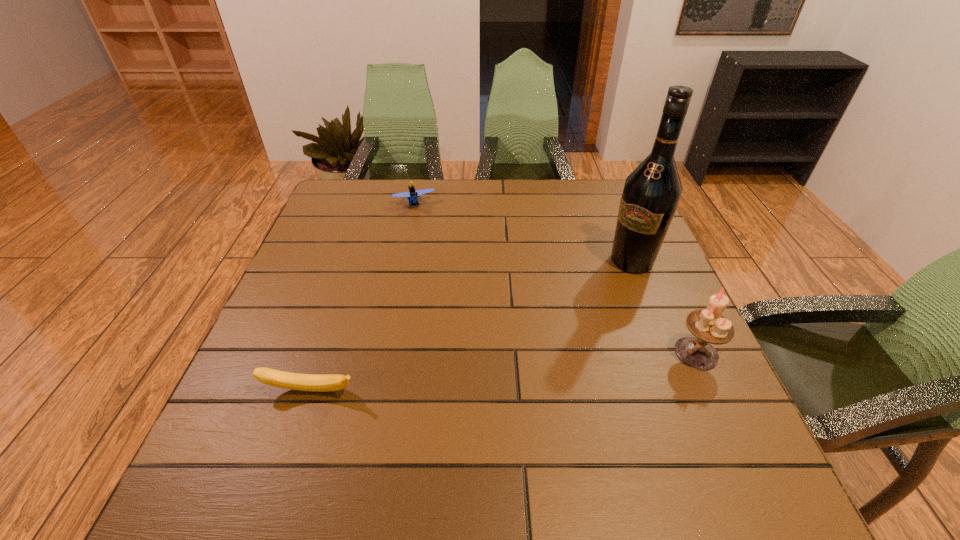
Image resolution: width=960 pixels, height=540 pixels. What are the coordinates of `vacant area situated on the label of the second farthest object` in the screenshot? It's located at (590, 313).

Find the location of `blank space located on the front-facing side of the Lego`. blank space located on the front-facing side of the Lego is located at coordinates (423, 227).

At what (x,y) coordinates should I click in order to perform the action: click on free location located 0.070m on the front-facing side of the Lego. Please return your answer as a coordinate pair (x, y). The image size is (960, 540). Looking at the image, I should click on (422, 225).

Locate an element on the screen. Image resolution: width=960 pixels, height=540 pixels. vacant space located 0.200m on the front-facing side of the Lego is located at coordinates (432, 253).

I want to click on object present at the far edge, so click(412, 196).

Identify the location of object that is at the near edge. (303, 382).

The width and height of the screenshot is (960, 540). What are the coordinates of `object located in the left edge section of the desktop` in the screenshot? It's located at (303, 382).

You are a GUI agent. You are given a task and a screenshot of the screen. Output one action in this format:
    pyautogui.click(x=<x>, y=<y>)
    Task: Click on the candle holder that is positioned at the right edge
    
    Given the screenshot: What is the action you would take?
    pyautogui.click(x=709, y=326)

Where is `wine bottle that is at the right edge`? This screenshot has height=540, width=960. wine bottle that is at the right edge is located at coordinates (651, 194).

You are a GUI agent. You are given a task and a screenshot of the screen. Output one action in this format:
    pyautogui.click(x=<x>, y=<y>)
    Task: Click on the object that is at the near left corner
    This screenshot has width=960, height=540.
    Given the screenshot: What is the action you would take?
    pyautogui.click(x=303, y=382)